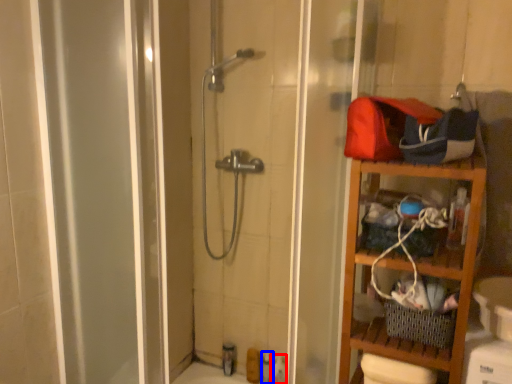
Question: Among these objects, which one is farthest to the camera, toiletry (highlighted by a red box) or toiletry (highlighted by a blue box)?

Choices:
 (A) toiletry
 (B) toiletry

Answer: (B)